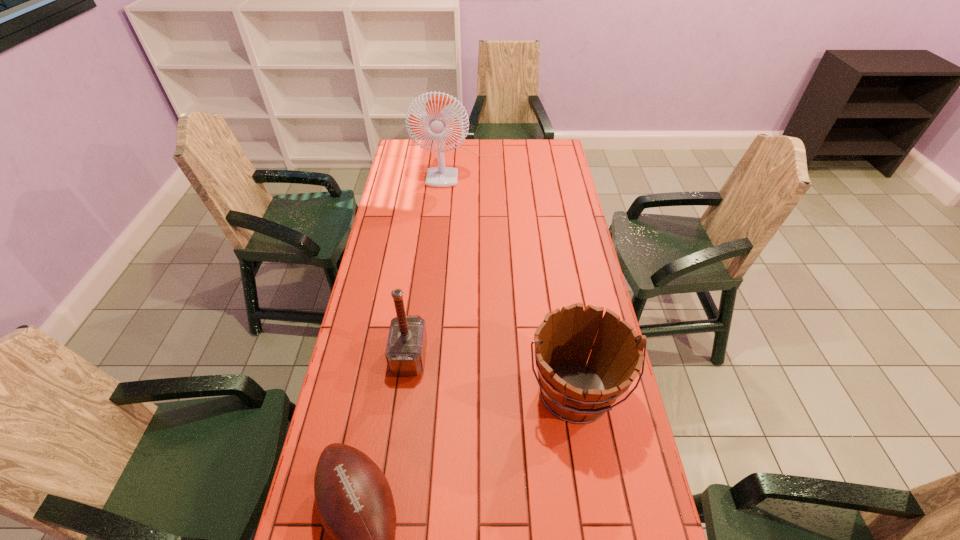
The height and width of the screenshot is (540, 960). I want to click on the farthest object, so click(441, 176).

Identify the location of fan. (441, 176).

At what (x,y) coordinates should I click in order to perform the action: click on hammer. Please return your answer as a coordinate pair (x, y). The width and height of the screenshot is (960, 540). Looking at the image, I should click on (405, 352).

In order to click on the rightmost object in this screenshot , I will do `click(576, 391)`.

Where is `vacant space situated 0.170m on the front-facing side of the fan`? The height and width of the screenshot is (540, 960). vacant space situated 0.170m on the front-facing side of the fan is located at coordinates (454, 212).

Locate an element on the screen. Image resolution: width=960 pixels, height=540 pixels. vacant space located on the back of the hammer is located at coordinates point(421,261).

Where is `vacant space situated with the handle on the rightmost object`? vacant space situated with the handle on the rightmost object is located at coordinates (594, 523).

This screenshot has height=540, width=960. Find the location of `object situated at the far edge`. object situated at the far edge is located at coordinates (441, 176).

Find the location of a particular element. fan that is positioned at the left edge is located at coordinates (441, 176).

This screenshot has width=960, height=540. In order to click on hammer situated at the left edge in this screenshot , I will do `click(405, 352)`.